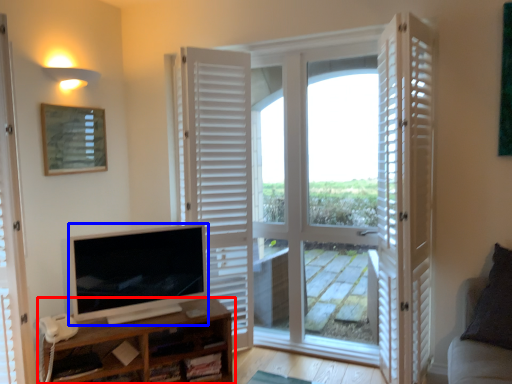
Question: Which point is closer to the camera, shelf (highlighted by a red box) or television (highlighted by a blue box)?

Choices:
 (A) shelf
 (B) television

Answer: (A)